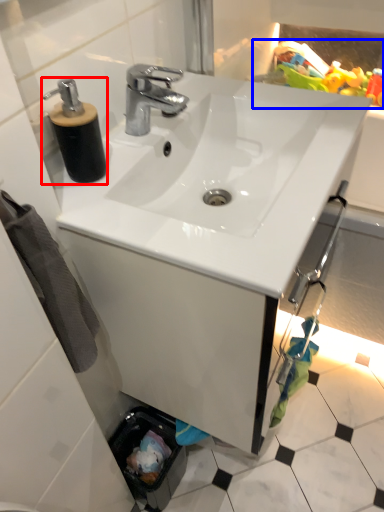
Question: Among these objects, which one is farthest to the camera, soap dispenser (highlighted by a red box) or toy (highlighted by a blue box)?

Choices:
 (A) soap dispenser
 (B) toy

Answer: (B)